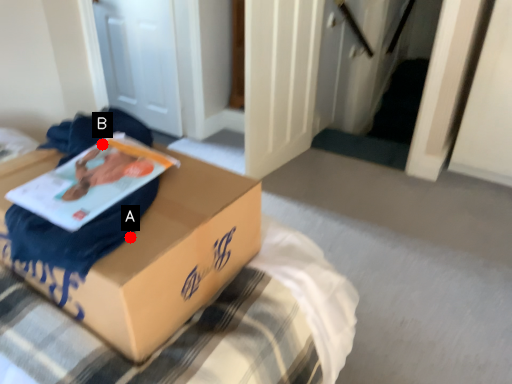
Question: Two points are circled on the image, labeled by A and B beside each circle. Which point is further to the camera?

Choices:
 (A) A is further
 (B) B is further

Answer: (B)